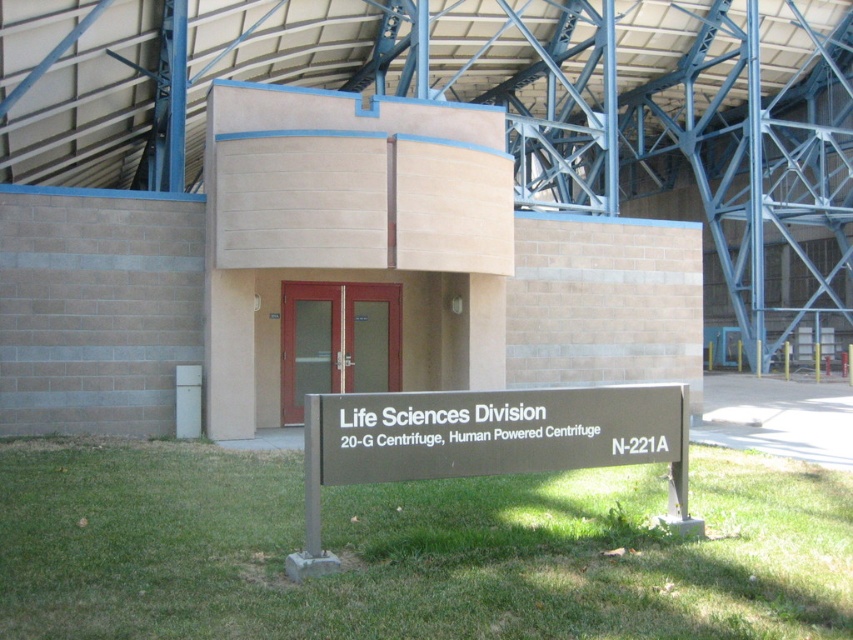
Looking at this image, you are a landscape architect planning to install a new pathway between the green grass at lower center and the brown metal sign at center. Considering their sizes, which area would require more material for the pathway base?

The brown metal sign at center requires more material for the pathway base because the green grass at lower center is smaller than the brown metal sign at center, indicating the sign area is larger.

You are a maintenance worker needing to access the brown metal sign at center to repair it. The green grass at lower center is in the way. Can you step over the grass to reach the sign?

The green grass at lower center has a lesser height compared to brown metal sign at center, so yes, you can step over the grass to reach the brown metal sign at center since the grass is shorter than the sign.

You are a maintenance worker needing to access the brown metal sign at center for repairs. The green grass at lower center is slippery. Based on their positions, which object should you avoid stepping on while reaching the sign?

The green grass at lower center is located below the brown metal sign at center, so you should avoid stepping on the green grass at lower center to prevent slipping while reaching the sign.